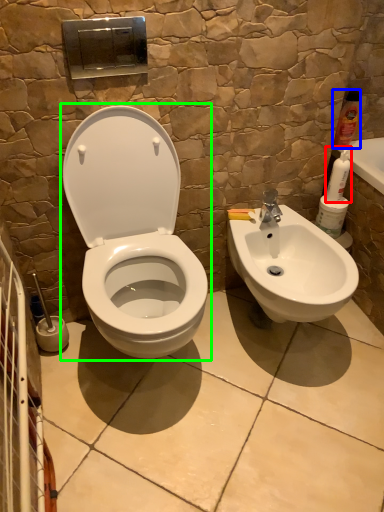
Question: Which object is positioned farthest from cleaning product (highlighted by a red box)? Select from cleaning product (highlighted by a blue box) and toilet (highlighted by a green box).

Choices:
 (A) cleaning product
 (B) toilet

Answer: (B)